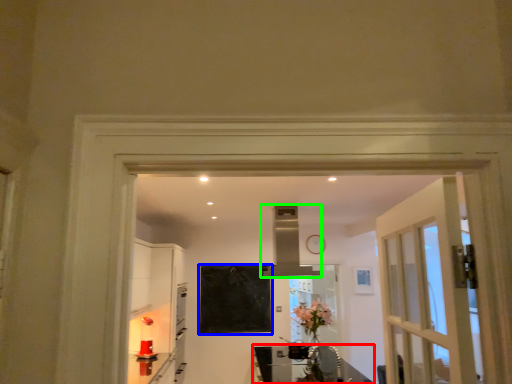
Question: Estimate the real-world distances between objects in this image. Which object is farther from table (highlighted by a red box), bulletin board (highlighted by a blue box) or exhaust hood (highlighted by a green box)?

Choices:
 (A) bulletin board
 (B) exhaust hood

Answer: (B)